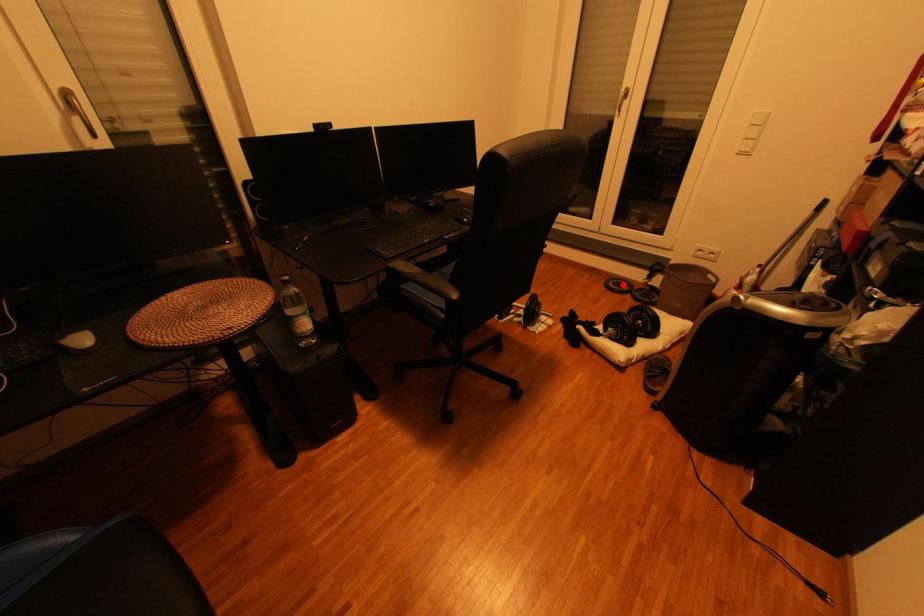
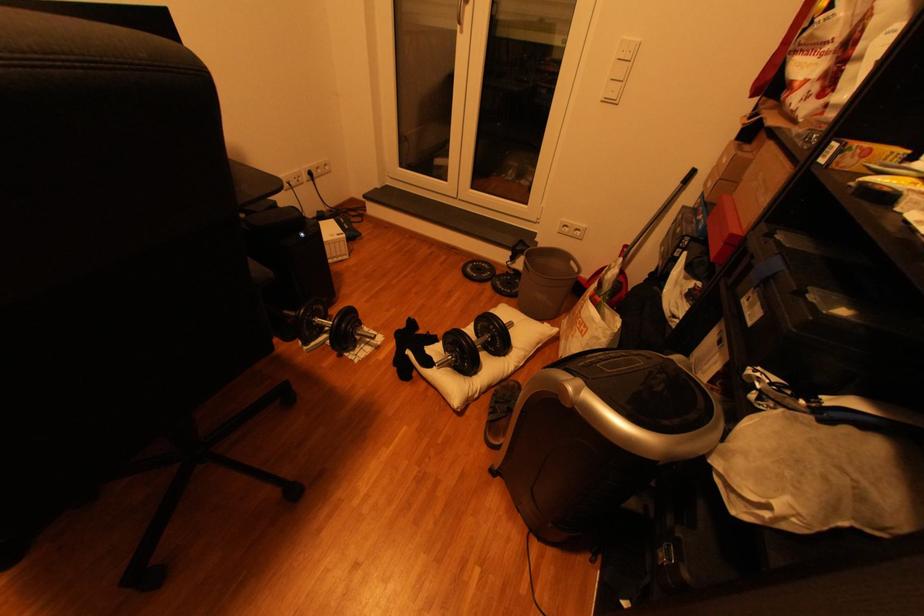
Question: A red point is marked in image1. In image2, is the corresponding 3D point closer to the camera or farther? Reply with the corresponding letter.

Choices:
 (A) The corresponding 3D point is closer.
 (B) The corresponding 3D point is farther.

Answer: (B)